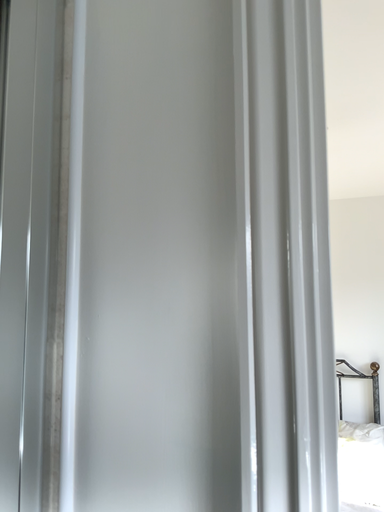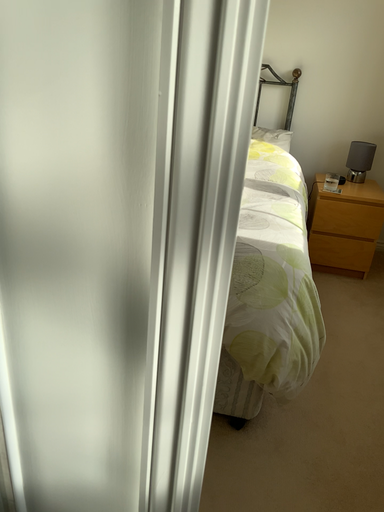
Question: Which way did the camera rotate in the video?

Choices:
 (A) rotated upward
 (B) rotated downward

Answer: (B)